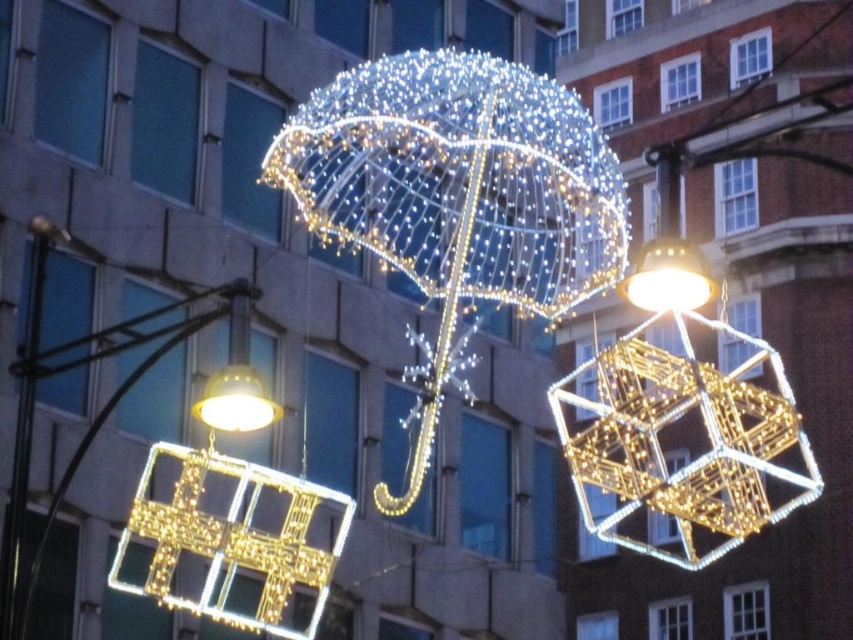
Is gold wire street light at left wider than matte gold cube at upper center?

Indeed, gold wire street light at left has a greater width compared to matte gold cube at upper center.

Is gold wire street light at left closer to the viewer compared to matte gold cube at upper center?

No.

This screenshot has height=640, width=853. Describe the element at coordinates (94, 417) in the screenshot. I see `gold wire street light at left` at that location.

Where is `gold wire street light at left`? This screenshot has width=853, height=640. gold wire street light at left is located at coordinates (94, 417).

Can you confirm if illuminated wireframe cube at center is taller than gold wire street light at left?

Yes, illuminated wireframe cube at center is taller than gold wire street light at left.

Who is lower down, illuminated wireframe cube at center or gold wire street light at left?

gold wire street light at left is lower down.

Which is in front, point (460, 388) or point (59, 492)?

Positioned in front is point (59, 492).

I want to click on illuminated wireframe cube at center, so click(x=457, y=198).

Who is positioned more to the left, iridescent glass cube at center or matte gold light at lower left?

matte gold light at lower left is more to the left.

Is point (672, 476) behind point (215, 396)?

Yes.

What do you see at coordinates (676, 419) in the screenshot? I see `iridescent glass cube at center` at bounding box center [676, 419].

What are the coordinates of `iridescent glass cube at center` in the screenshot? It's located at [x=676, y=419].